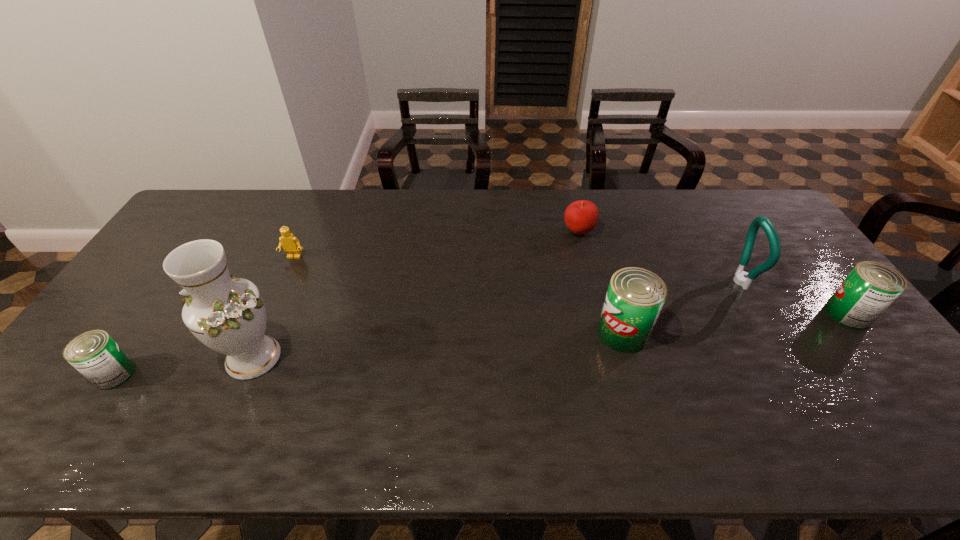
Locate an element on the screen. The height and width of the screenshot is (540, 960). free space between the tallest object and the nearest can is located at coordinates click(x=184, y=366).

Where is `free point between the third tallest object and the bottle opener`? free point between the third tallest object and the bottle opener is located at coordinates (681, 307).

This screenshot has width=960, height=540. In order to click on free space between the vase and the fifth shortest object in this screenshot , I will do [438, 345].

Identify the location of blank region between the bottle opener and the tallest object. This screenshot has width=960, height=540. (495, 319).

The width and height of the screenshot is (960, 540). Find the location of `free space between the second can from right to left and the rightmost object`. free space between the second can from right to left and the rightmost object is located at coordinates (735, 323).

What are the coordinates of `free space between the second shortest can and the Lego` in the screenshot? It's located at (571, 286).

Where is `vacant area between the second object from right to left and the farthest object`? The width and height of the screenshot is (960, 540). vacant area between the second object from right to left and the farthest object is located at coordinates (659, 256).

Image resolution: width=960 pixels, height=540 pixels. Find the location of `free space between the vase and the nearest can`. free space between the vase and the nearest can is located at coordinates (184, 366).

You are a GUI agent. You are given a task and a screenshot of the screen. Output one action in this format:
    pyautogui.click(x=<x>, y=<y>)
    Task: Click on the free space between the tallest can and the Lego
    
    Given the screenshot: What is the action you would take?
    pyautogui.click(x=458, y=295)

I want to click on empty space that is in between the sixth nearest object and the farthest object, so click(x=436, y=245).